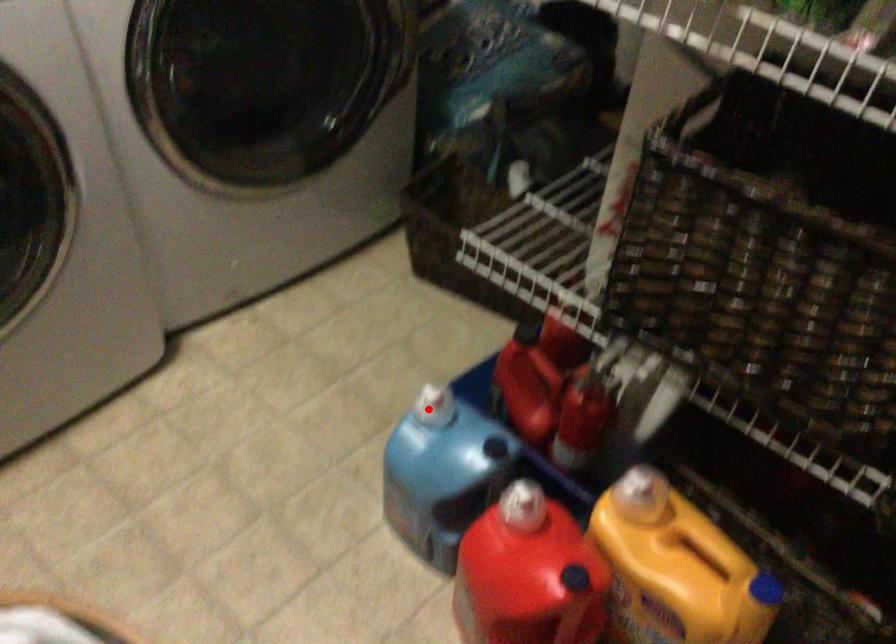
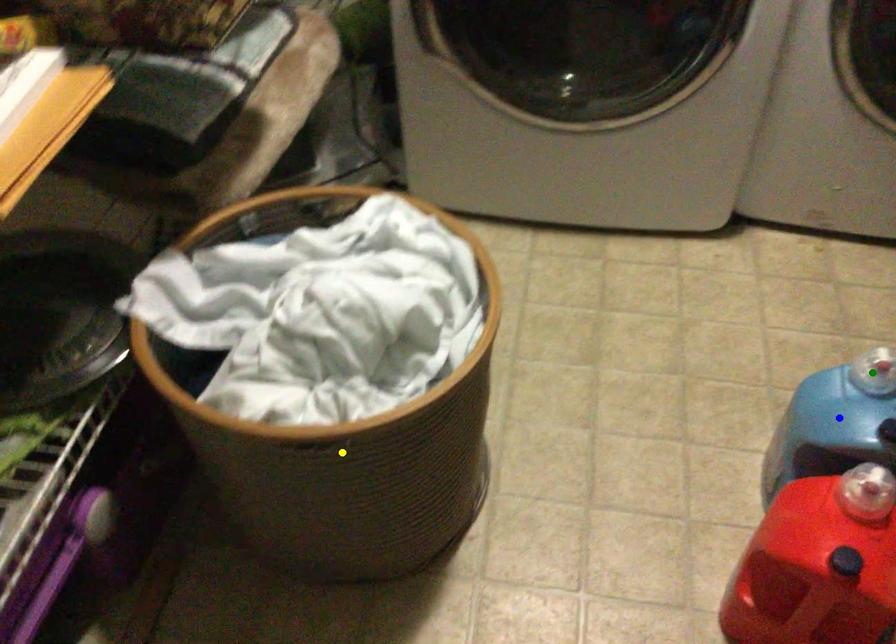
Question: I am providing you with two images of the same scene from different viewpoints. A red point is marked on the first image. You are given multiple points on the second image. Which spot in image 2 lines up with the point in image 1?

Choices:
 (A) green point
 (B) yellow point
 (C) blue point

Answer: (A)